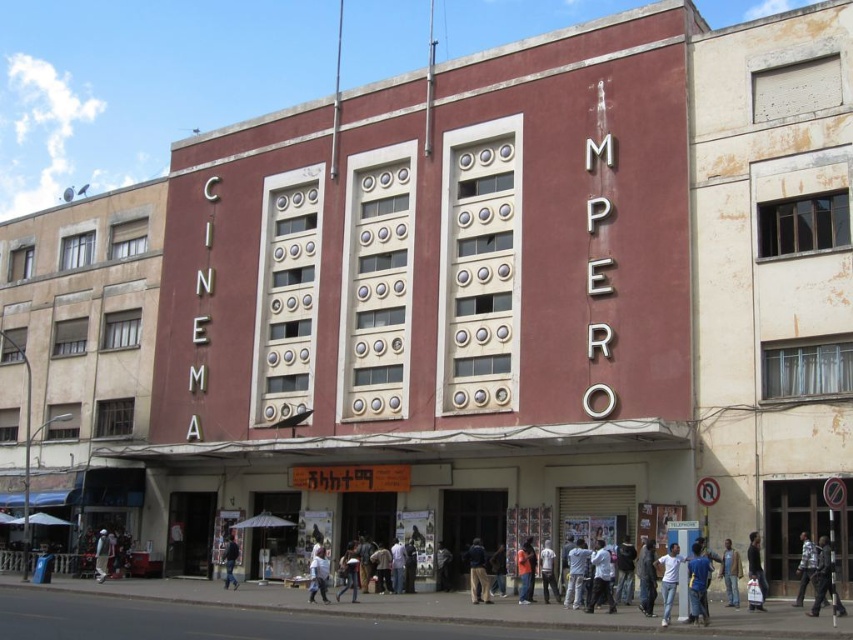
You are standing in front of the Cinema Impero and want to place two markers at the coordinates point (668, 616) and point (344, 557). Which marker will be closer to you?

Point (668, 616) is closer to the viewer than point (344, 557).

You are a photographer trying to capture the Cinema Impero building. You notice two people in the scene wearing dark blue uniform at lower right and dark blue jeans at center. Which clothing item is wider?

The dark blue uniform at lower right is wider than the dark blue jeans at center.